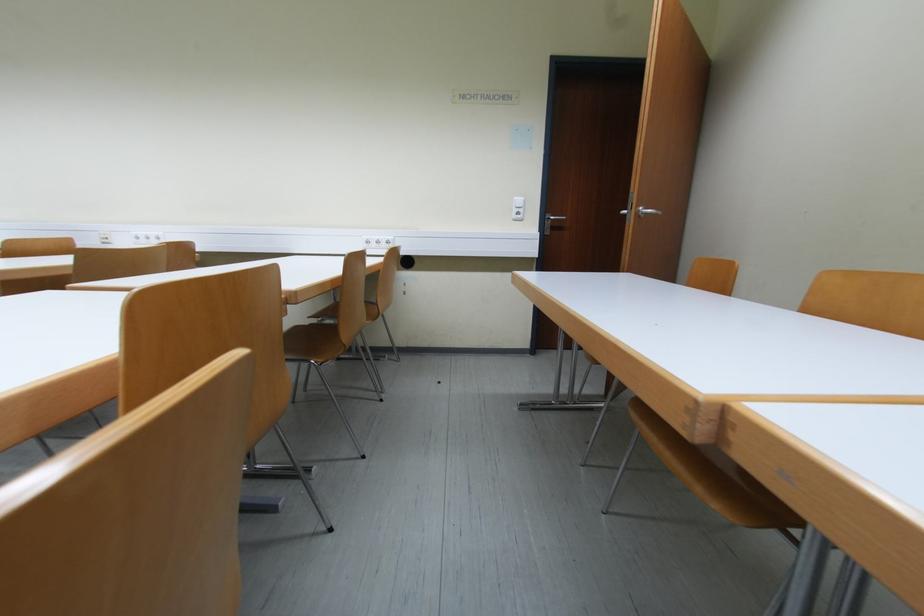
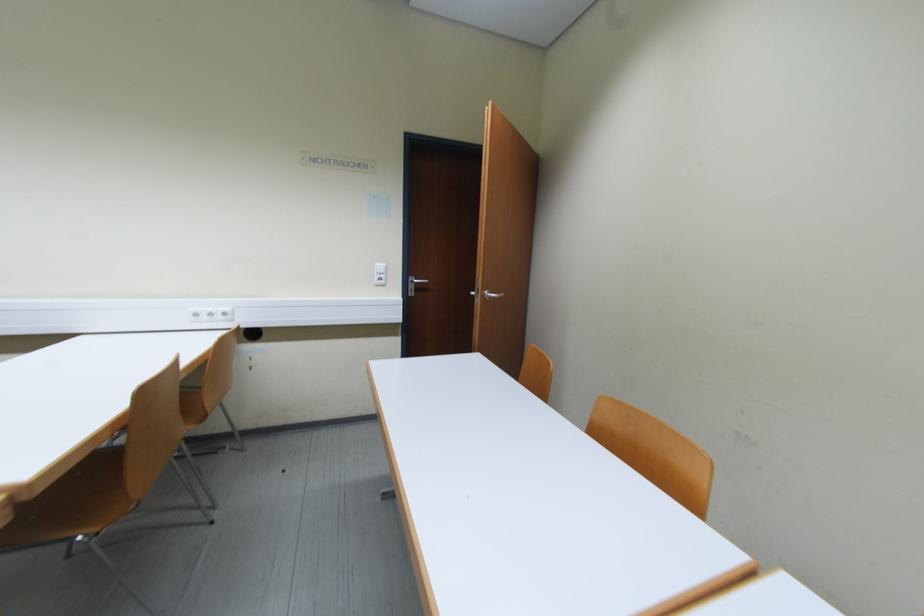
Question: The camera is either moving clockwise (left) or counter-clockwise (right) around the object. The first image is from the beginning of the video and the second image is from the end. Is the camera moving left or right when shooting the video?

Choices:
 (A) Left
 (B) Right

Answer: (A)